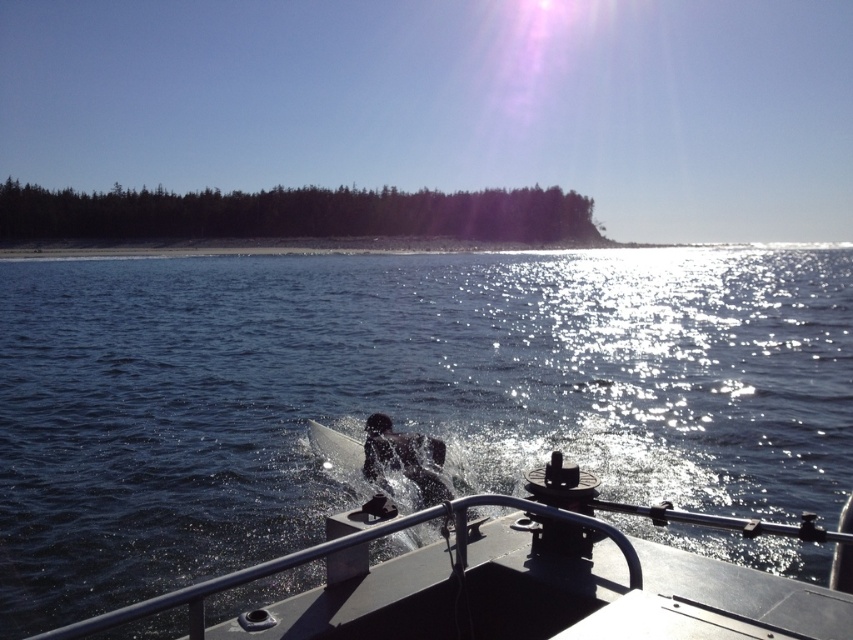
Describe the element at coordinates (393, 396) in the screenshot. I see `dark blue water at center` at that location.

Which of these two, dark blue water at center or metallic gray boat at center, stands taller?

dark blue water at center

Which is in front, point (164, 612) or point (815, 605)?

Point (815, 605) is in front.

Where is `dark blue water at center`? dark blue water at center is located at coordinates (393, 396).